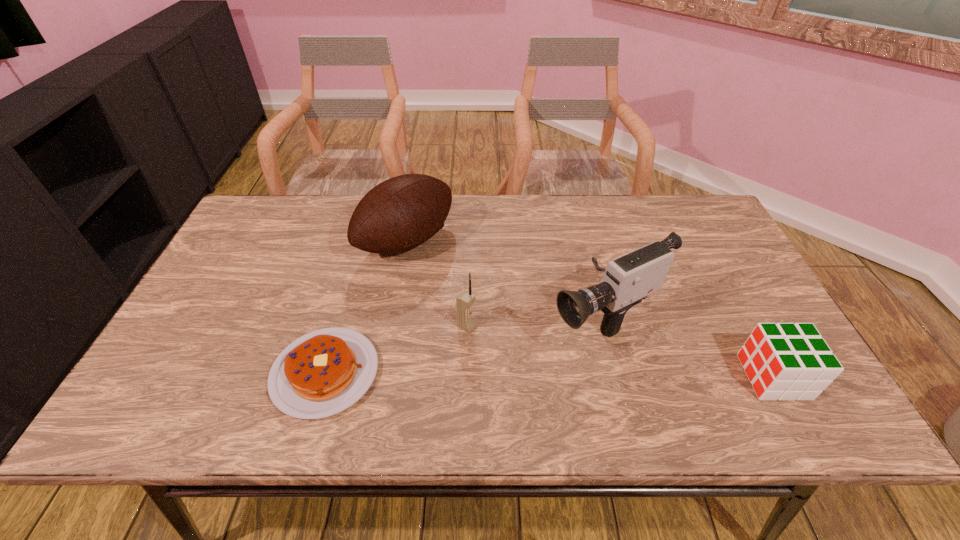
Find the location of a particular element. object that is the fourth closest to the fourth object from left to right is located at coordinates (322, 373).

Identify the location of object that stands as the second closest to the second object from right to left. The width and height of the screenshot is (960, 540). (465, 321).

This screenshot has height=540, width=960. Find the location of `vacant space that satisfies the following two spatial constraints: 1. on the back side of the football; 2. on the left side of the pancake`. vacant space that satisfies the following two spatial constraints: 1. on the back side of the football; 2. on the left side of the pancake is located at coordinates (363, 241).

At what (x,y) coordinates should I click in order to perform the action: click on free space that satisfies the following two spatial constraints: 1. on the back side of the pancake; 2. on the right side of the football. Please return your answer as a coordinate pair (x, y). This screenshot has height=540, width=960. Looking at the image, I should click on (363, 241).

This screenshot has width=960, height=540. Identify the location of free location that satisfies the following two spatial constraints: 1. on the back side of the third object from left to right; 2. on the right side of the shortest object. (339, 327).